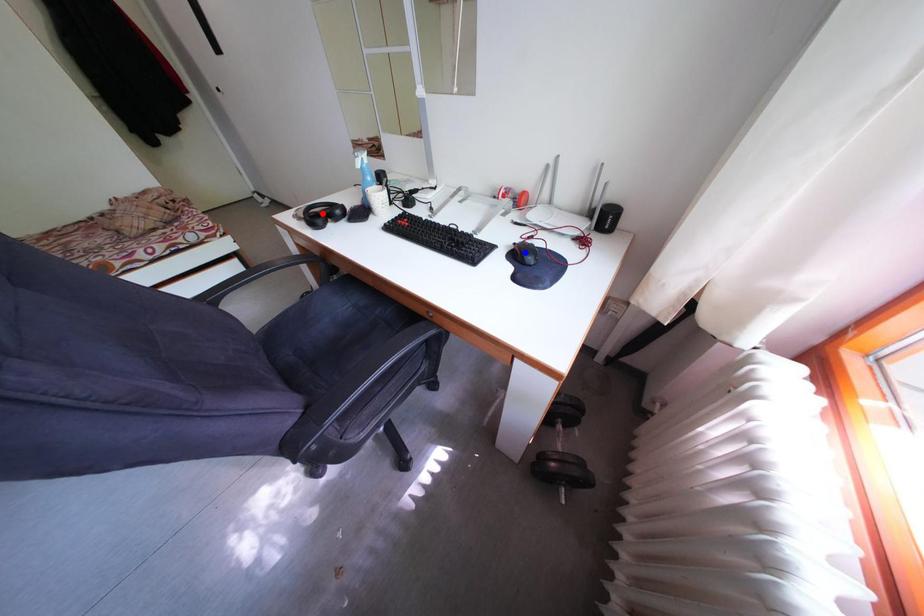
Question: In the image, two points are highlighted. Which point is nearer to the camera? Reply with the corresponding letter.

Choices:
 (A) blue point
 (B) red point

Answer: (A)